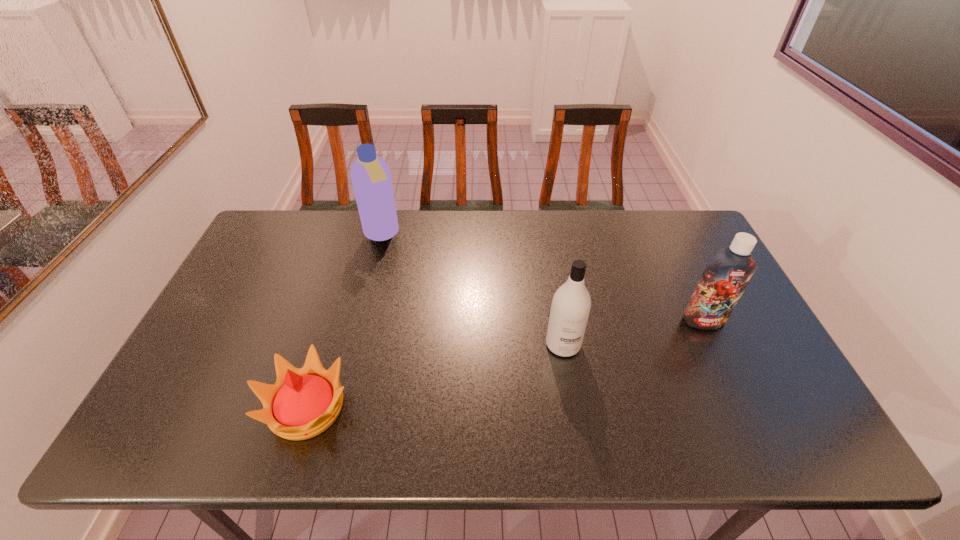
Locate which object ranks in proximity to the second shampoo from left to right. Please provide its 2D coordinates. Your answer should be formatted as a tuple, i.e. [(x, y)], where the tuple contains the x and y coordinates of a point satisfying the conditions above.

[(726, 275)]

Identify which shampoo is located as the nearest to the crown. Please provide its 2D coordinates. Your answer should be formatted as a tuple, i.e. [(x, y)], where the tuple contains the x and y coordinates of a point satisfying the conditions above.

[(371, 178)]

Locate which shampoo ranks in proximity to the second object from right to left. Please provide its 2D coordinates. Your answer should be formatted as a tuple, i.e. [(x, y)], where the tuple contains the x and y coordinates of a point satisfying the conditions above.

[(726, 275)]

The image size is (960, 540). I want to click on vacant space that satisfies the following two spatial constraints: 1. on the back side of the farthest shampoo; 2. on the right side of the crown, so click(361, 234).